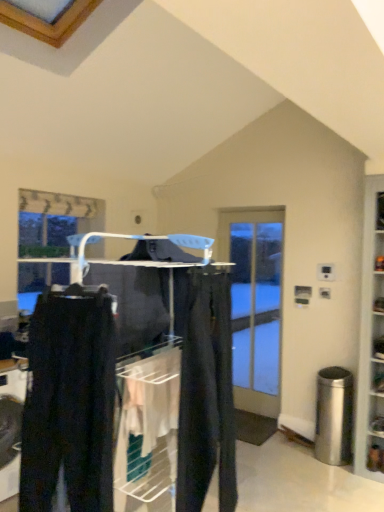
Question: Does dark gray pants at center appear on the right side of matte black pants at center?

Choices:
 (A) yes
 (B) no

Answer: (B)

Question: From the image's perspective, is dark gray pants at center beneath matte black pants at center?

Choices:
 (A) yes
 (B) no

Answer: (B)

Question: Is dark gray pants at center wider than matte black pants at center?

Choices:
 (A) no
 (B) yes

Answer: (A)

Question: Is dark gray pants at center smaller than matte black pants at center?

Choices:
 (A) no
 (B) yes

Answer: (B)

Question: From a real-world perspective, is dark gray pants at center located higher than matte black pants at center?

Choices:
 (A) no
 (B) yes

Answer: (B)

Question: Could matte black pants at center be considered to be inside dark gray pants at center?

Choices:
 (A) yes
 (B) no

Answer: (B)

Question: Is dark gray pants at center shorter than clear glass door at center?

Choices:
 (A) yes
 (B) no

Answer: (A)

Question: From a real-world perspective, is dark gray pants at center located higher than clear glass door at center?

Choices:
 (A) no
 (B) yes

Answer: (B)

Question: From a real-world perspective, is dark gray pants at center physically below clear glass door at center?

Choices:
 (A) no
 (B) yes

Answer: (A)

Question: Is the depth of dark gray pants at center greater than that of clear glass door at center?

Choices:
 (A) no
 (B) yes

Answer: (A)

Question: Is dark gray pants at center taller than clear glass door at center?

Choices:
 (A) yes
 (B) no

Answer: (B)

Question: Would you say dark gray pants at center is outside clear glass door at center?

Choices:
 (A) no
 (B) yes

Answer: (B)

Question: Is clear glass door at center touching dark gray pants at center?

Choices:
 (A) no
 (B) yes

Answer: (A)